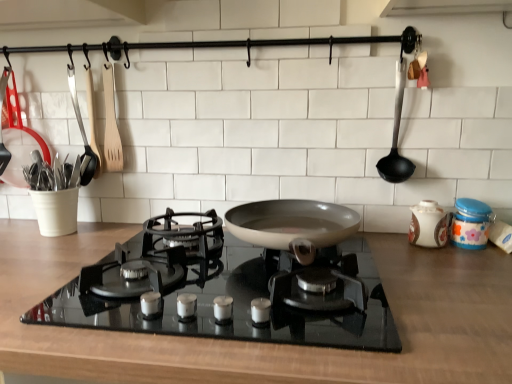
Where is `vacant position to the left of porcelain jar at right, the fourth kitchen appliance when ordered from left to right`? The width and height of the screenshot is (512, 384). vacant position to the left of porcelain jar at right, the fourth kitchen appliance when ordered from left to right is located at coordinates (388, 244).